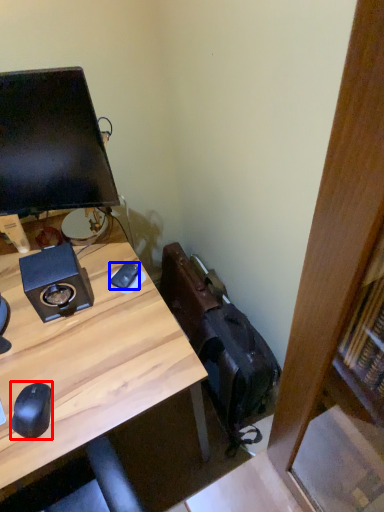
Question: Which of the following is the closest to the observer, mouse (highlighted by a red box) or mouse (highlighted by a blue box)?

Choices:
 (A) mouse
 (B) mouse

Answer: (A)